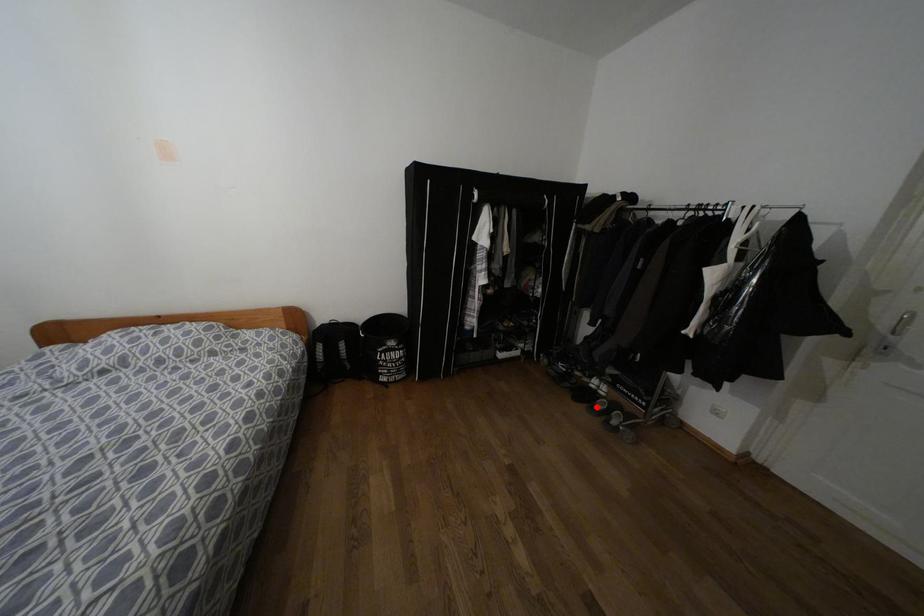
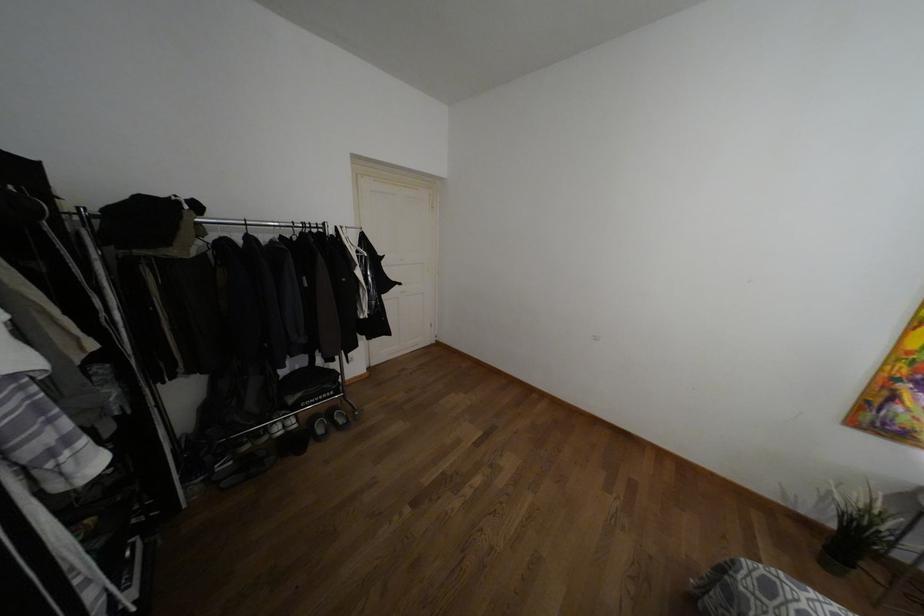
Question: I am providing you with two images of the same scene from different viewpoints. Given a red point in image1, look at the same physical point in image2. Is it:

Choices:
 (A) Closer to the viewpoint
 (B) Farther from the viewpoint

Answer: (B)